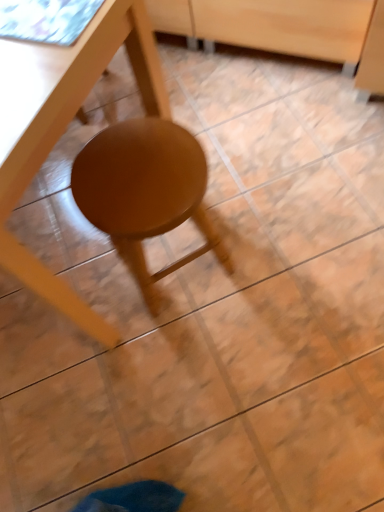
What do you see at coordinates (64, 127) in the screenshot? This screenshot has height=512, width=384. I see `matte wood table at center` at bounding box center [64, 127].

What are the coordinates of `matte wood stool at center` in the screenshot? It's located at (144, 192).

Are matte wood stool at center and matte wood table at center making contact?

No, matte wood stool at center is not touching matte wood table at center.

Is matte wood stool at center taller than matte wood table at center?

Incorrect, the height of matte wood stool at center is not larger of that of matte wood table at center.

From the picture: Does matte wood stool at center appear on the left side of matte wood table at center?

No.

From the image's perspective, does matte wood table at center appear higher than wooden drawer at center?

No, from the image's perspective, matte wood table at center is not on top of wooden drawer at center.

Which object is positioned more to the left, matte wood table at center or wooden drawer at center?

matte wood table at center is more to the left.

Which is in front, point (10, 137) or point (342, 17)?

The point (10, 137) is closer.

Can you tell me how much matte wood table at center and wooden drawer at center differ in facing direction?

The angle between the facing direction of matte wood table at center and the facing direction of wooden drawer at center is 89.4 degrees.

Locate an element on the screen. stool lying on the right of matte wood table at center is located at coordinates [144, 192].

Based on their positions, is matte wood table at center located to the left or right of matte wood stool at center?

Clearly, matte wood table at center is on the left of matte wood stool at center in the image.

How different are the orientations of matte wood table at center and matte wood stool at center in degrees?

179 degrees separate the facing orientations of matte wood table at center and matte wood stool at center.

Considering the sizes of matte wood table at center and matte wood stool at center in the image, is matte wood table at center wider or thinner than matte wood stool at center?

In the image, matte wood table at center appears to be wider than matte wood stool at center.

Is wooden drawer at center oriented away from matte wood table at center?

wooden drawer at center does not have its back to matte wood table at center.

Identify the location of drawer behind the matte wood table at center. (287, 26).

From a real-world perspective, who is located lower, wooden drawer at center or matte wood table at center?

wooden drawer at center, from a real-world perspective.

Considering the relative sizes of wooden drawer at center and matte wood table at center in the image provided, is wooden drawer at center shorter than matte wood table at center?

Yes.

Is there a large distance between wooden drawer at center and matte wood stool at center?

No, wooden drawer at center is not far from matte wood stool at center.

Is wooden drawer at center shorter than matte wood stool at center?

Indeed, wooden drawer at center has a lesser height compared to matte wood stool at center.

From a real-world perspective, is wooden drawer at center physically located above or below matte wood stool at center?

wooden drawer at center is below matte wood stool at center.

Between wooden drawer at center and matte wood stool at center, which one is positioned behind?

wooden drawer at center is behind.

Can you tell me how much matte wood stool at center and wooden drawer at center differ in facing direction?

They differ by 91.7 degrees in their facing directions.

Can you confirm if matte wood stool at center is thinner than wooden drawer at center?

Yes, matte wood stool at center is thinner than wooden drawer at center.

From the picture: Choose the correct answer: Is matte wood stool at center inside wooden drawer at center or outside it?

matte wood stool at center is not enclosed by wooden drawer at center.

Considering the sizes of objects matte wood stool at center and wooden drawer at center in the image provided, who is bigger, matte wood stool at center or wooden drawer at center?

With larger size is wooden drawer at center.

Find the location of `table above the matte wood stool at center (from the image's perspective)`. table above the matte wood stool at center (from the image's perspective) is located at coordinates (64, 127).

Locate an element on the screen. This screenshot has height=512, width=384. drawer behind the matte wood table at center is located at coordinates (287, 26).

Consider the image. Considering their positions, is matte wood table at center positioned further to matte wood stool at center than wooden drawer at center?

wooden drawer at center is further to matte wood stool at center.

Estimate the real-world distances between objects in this image. Which object is further from matte wood table at center, wooden drawer at center or matte wood stool at center?

The object further to matte wood table at center is wooden drawer at center.

Looking at the image, which one is located closer to wooden drawer at center, matte wood table at center or matte wood stool at center?

Based on the image, matte wood stool at center appears to be nearer to wooden drawer at center.

Estimate the real-world distances between objects in this image. Which object is closer to matte wood table at center, matte wood stool at center or wooden drawer at center?

matte wood stool at center.

Considering their positions, is matte wood stool at center positioned closer to wooden drawer at center than matte wood table at center?

matte wood stool at center is closer to wooden drawer at center.

Which object lies further to the anchor point matte wood stool at center, wooden drawer at center or matte wood table at center?

Based on the image, wooden drawer at center appears to be further to matte wood stool at center.

This screenshot has height=512, width=384. I want to click on table between wooden drawer at center and matte wood stool at center vertically, so click(x=64, y=127).